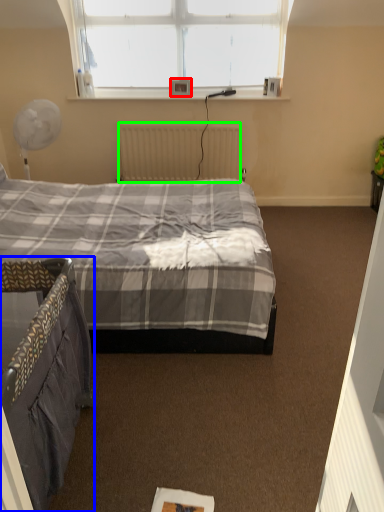
Question: Considering the real-world distances, which object is farthest from picture frame (highlighted by a red box)? bed (highlighted by a blue box) or radiator (highlighted by a green box)?

Choices:
 (A) bed
 (B) radiator

Answer: (A)